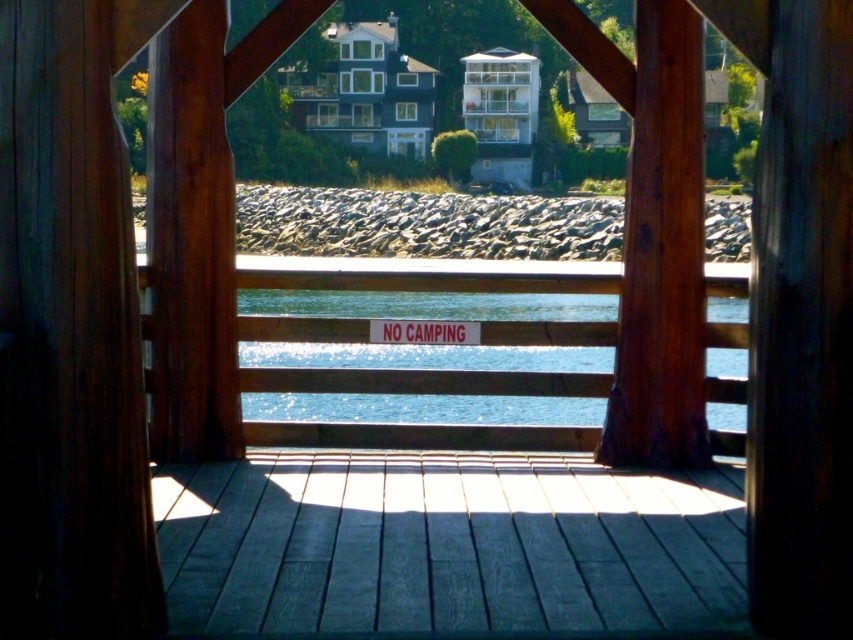
Question: Which object appears farthest from the camera in this image?

Choices:
 (A) brown wood at center
 (B) white plastic sign at center
 (C) smooth gray wood deck at center

Answer: (B)

Question: Estimate the real-world distances between objects in this image. Which object is closer to the smooth gray wood deck at center?

Choices:
 (A) brown wood at center
 (B) white plastic sign at center
 (C) blue water at center

Answer: (B)

Question: Which object is positioned farthest from the blue water at center?

Choices:
 (A) brown wood at center
 (B) smooth gray wood deck at center
 (C) white plastic sign at center

Answer: (A)

Question: Can you confirm if smooth gray wood deck at center is positioned below white plastic sign at center?

Choices:
 (A) no
 (B) yes

Answer: (B)

Question: Does blue water at center come behind white plastic sign at center?

Choices:
 (A) yes
 (B) no

Answer: (B)

Question: Is smooth gray wood deck at center thinner than blue water at center?

Choices:
 (A) yes
 (B) no

Answer: (A)